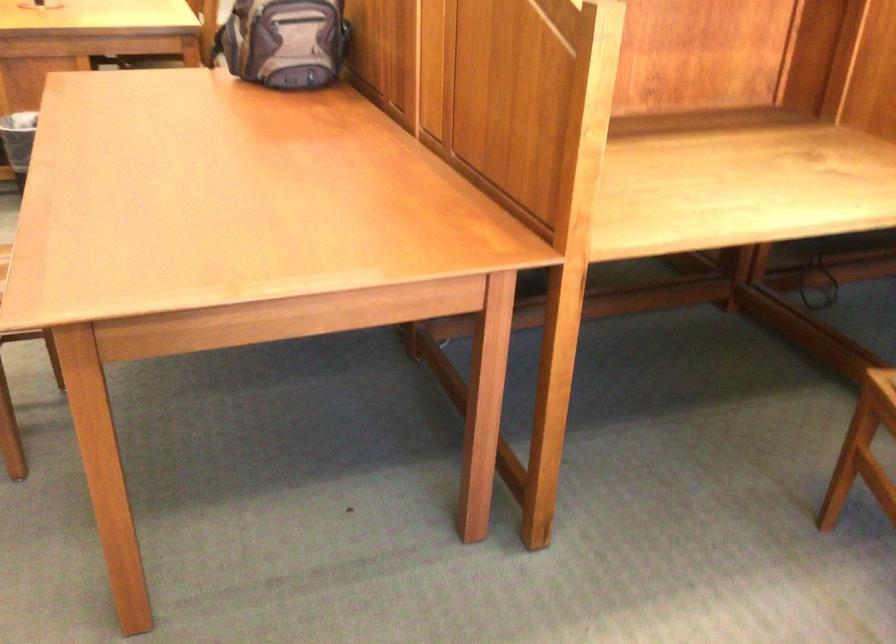
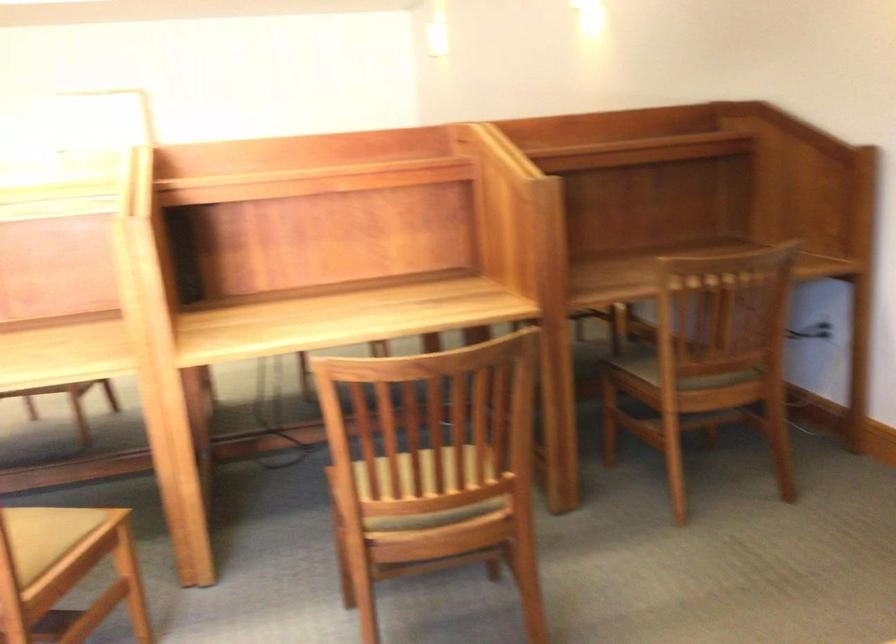
Question: In a continuous first-person perspective shot, in which direction is the camera moving?

Choices:
 (A) Left
 (B) Right
 (C) Forward
 (D) Backward

Answer: (B)